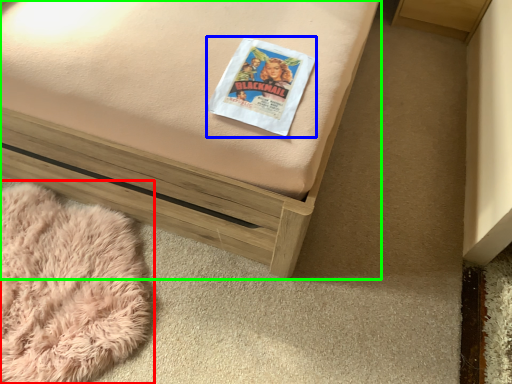
Question: Considering the real-world distances, which object is closest to blanket (highlighted by a red box)? paperback book (highlighted by a blue box) or furniture (highlighted by a green box).

Choices:
 (A) paperback book
 (B) furniture

Answer: (B)